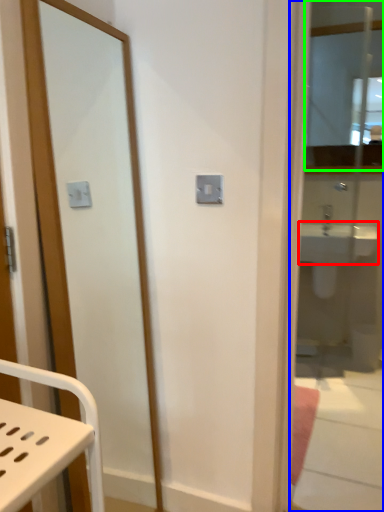
Question: Estimate the real-world distances between objects in this image. Which object is farther from sink (highlighted by a red box), mirror (highlighted by a blue box) or mirror (highlighted by a green box)?

Choices:
 (A) mirror
 (B) mirror

Answer: (B)